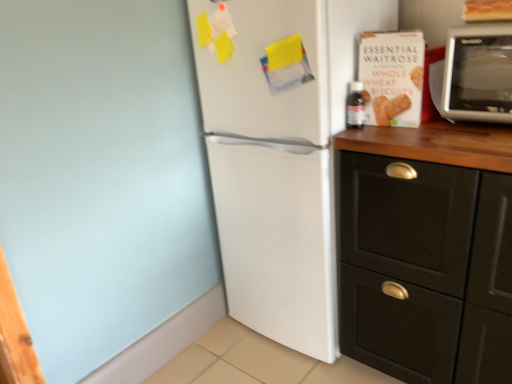
Question: In terms of width, does black matte cabinet at right look wider or thinner when compared to silver metallic microwave at upper right?

Choices:
 (A) thin
 (B) wide

Answer: (B)

Question: Considering the positions of black matte cabinet at right and silver metallic microwave at upper right in the image, is black matte cabinet at right taller or shorter than silver metallic microwave at upper right?

Choices:
 (A) tall
 (B) short

Answer: (A)

Question: Which is nearer to the black matte cabinet at right?

Choices:
 (A) white matte refrigerator at center
 (B) white cardboard box of whole wheat biscuits at upper right
 (C) silver metallic microwave at upper right

Answer: (A)

Question: Which is farther from the white cardboard box of whole wheat biscuits at upper right?

Choices:
 (A) silver metallic microwave at upper right
 (B) black matte cabinet at right
 (C) white matte refrigerator at center

Answer: (B)